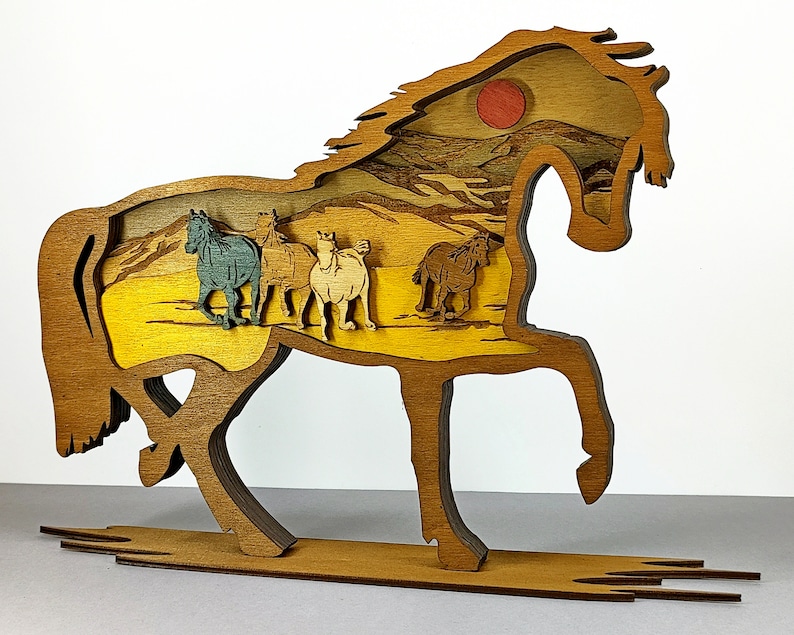
This screenshot has width=794, height=635. I want to click on table, so click(102, 605), click(338, 620), click(669, 531), click(345, 515).